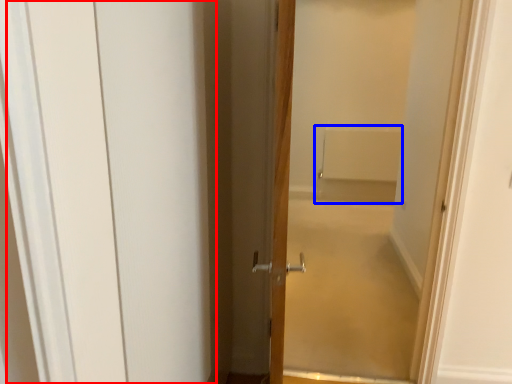
Question: Which of the following is the farthest to the observer, barn door (highlighted by a red box) or bath (highlighted by a blue box)?

Choices:
 (A) barn door
 (B) bath

Answer: (B)